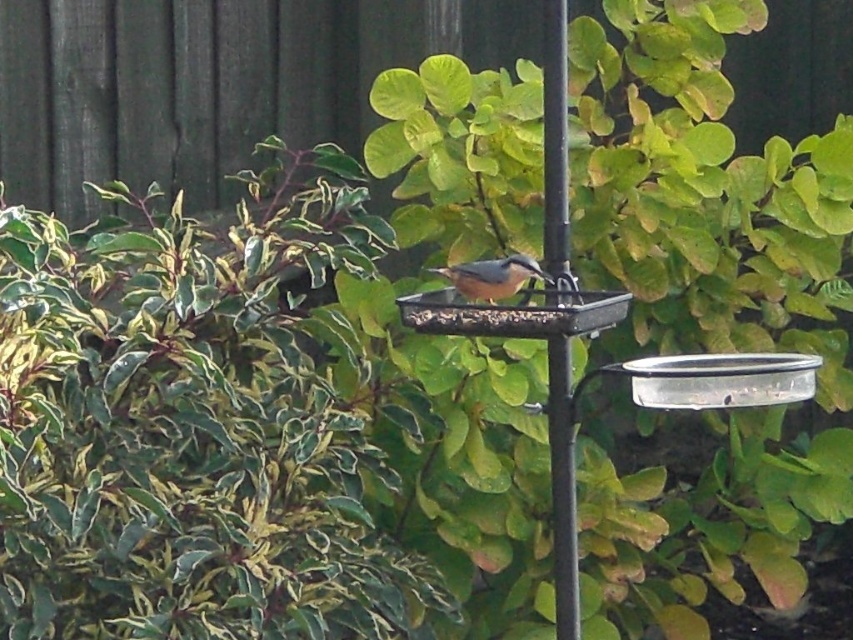
Question: Among these points, which one is farthest from the camera?

Choices:
 (A) (575, 637)
 (B) (624, 147)

Answer: (B)

Question: Considering the real-world distances, which object is closest to the green leafy bush at center?

Choices:
 (A) black metal pole at center
 (B) brown matte bird at center

Answer: (B)

Question: Is green leafy bush at center further to the viewer compared to black metal pole at center?

Choices:
 (A) no
 (B) yes

Answer: (B)

Question: Which object is closer to the camera taking this photo?

Choices:
 (A) green leafy bush at center
 (B) brown matte bird at center
 (C) black metal pole at center

Answer: (C)

Question: Is green leafy bush at center above brown matte bird at center?

Choices:
 (A) no
 (B) yes

Answer: (A)

Question: Where is black metal pole at center located in relation to brown matte bird at center in the image?

Choices:
 (A) left
 (B) right

Answer: (B)